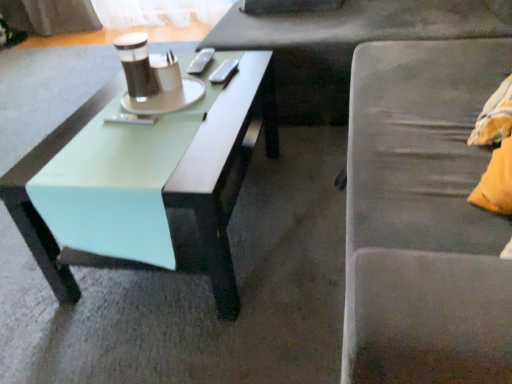
Where is `vacant space that is to the left of matte black remote control at center, the 1th remote control viewed from the front`? vacant space that is to the left of matte black remote control at center, the 1th remote control viewed from the front is located at coordinates (97, 127).